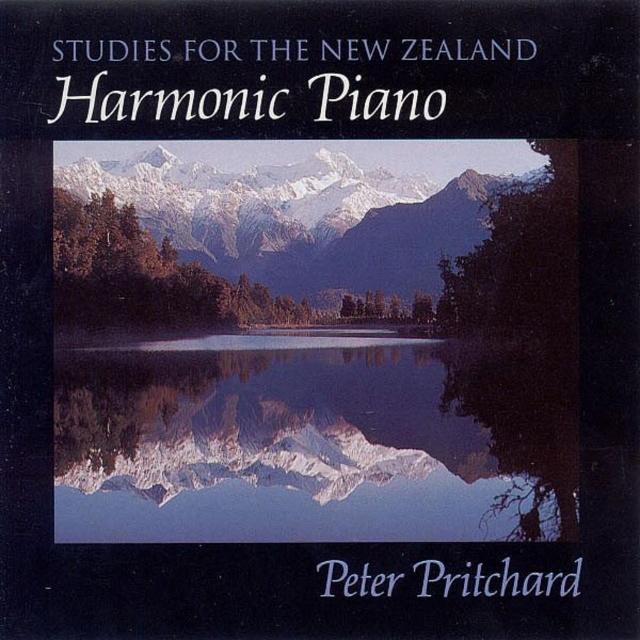
Identify the location of transparent glass water at center. (314, 442).

Does transparent glass water at center have a smaller size compared to snowy gray mountain range at center?

Indeed, transparent glass water at center has a smaller size compared to snowy gray mountain range at center.

Is point (182, 416) positioned after point (353, 243)?

No, (182, 416) is in front of (353, 243).

Locate an element on the screen. This screenshot has width=640, height=640. transparent glass water at center is located at coordinates (314, 442).